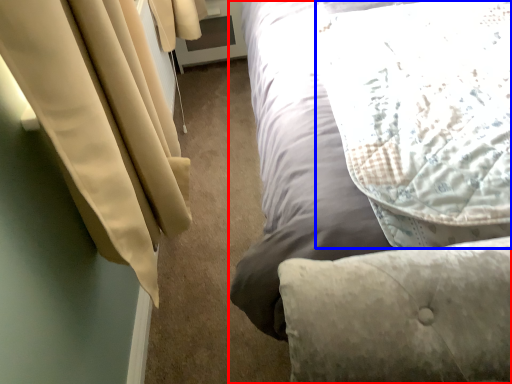
Question: Among these objects, which one is nearest to the camera, bed (highlighted by a red box) or pillow (highlighted by a blue box)?

Choices:
 (A) bed
 (B) pillow

Answer: (A)